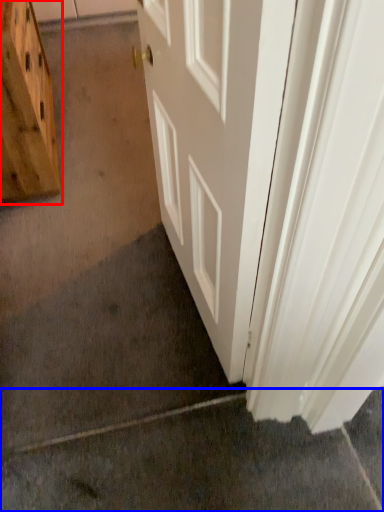
Question: Among these objects, which one is farthest to the camera, cabinetry (highlighted by a red box) or concrete (highlighted by a blue box)?

Choices:
 (A) cabinetry
 (B) concrete

Answer: (A)